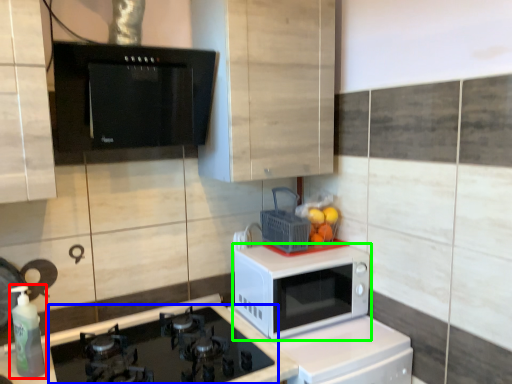
Question: Estimate the real-world distances between objects in this image. Which object is farther from bottle (highlighted by a red box), gas stove (highlighted by a blue box) or microwave oven (highlighted by a green box)?

Choices:
 (A) gas stove
 (B) microwave oven

Answer: (B)